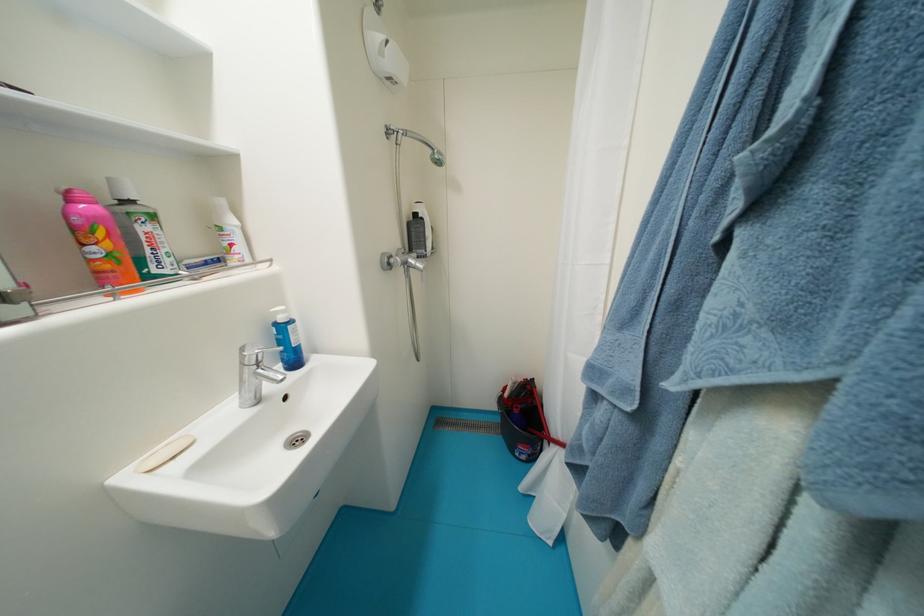
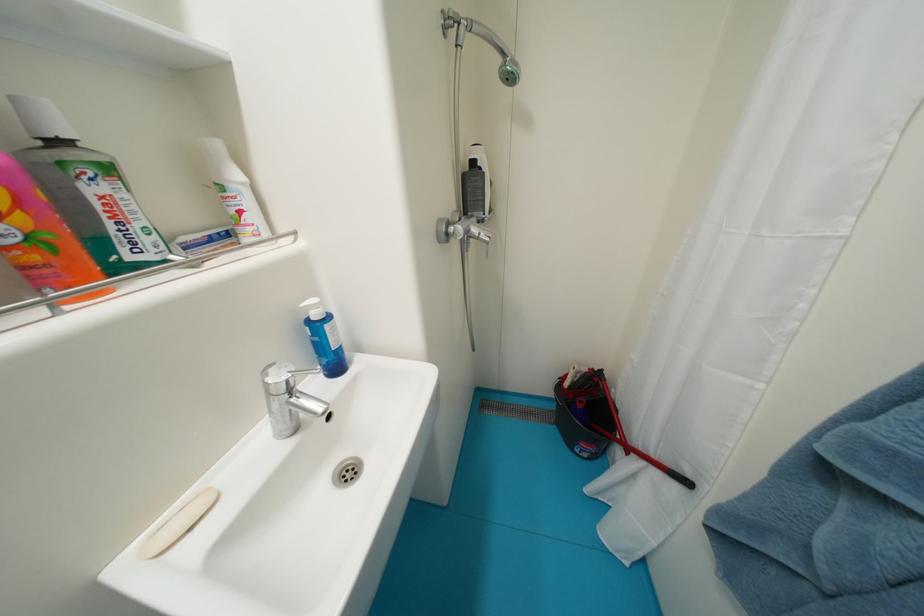
Which direction would the cameraman need to move to produce the second image?

The cameraman walked toward left, forward.